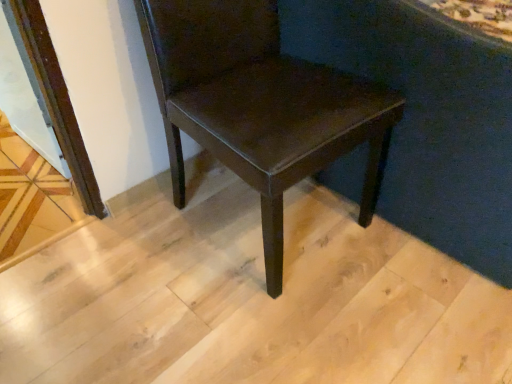
Where is `vacant area in front of matte dark brown chair at center`? vacant area in front of matte dark brown chair at center is located at coordinates (255, 325).